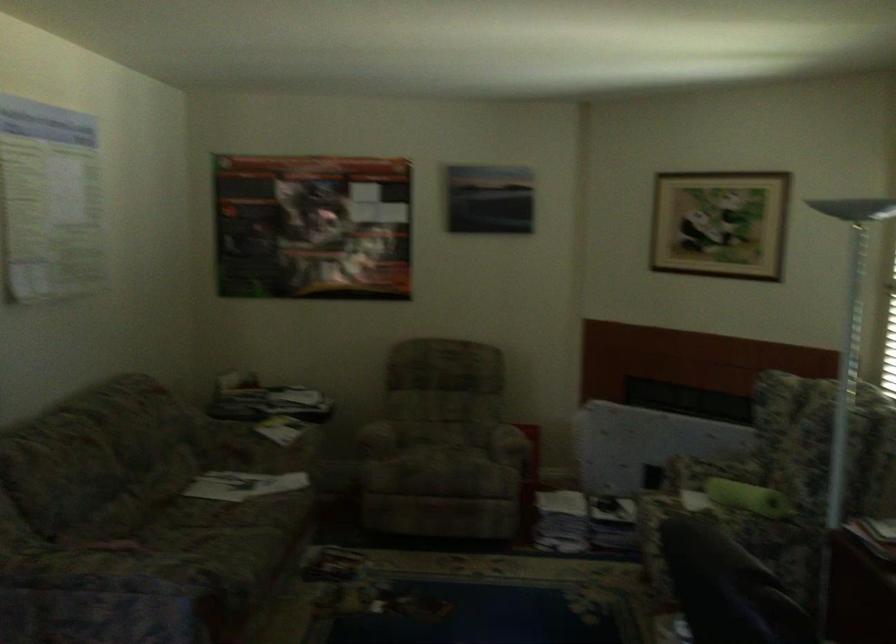
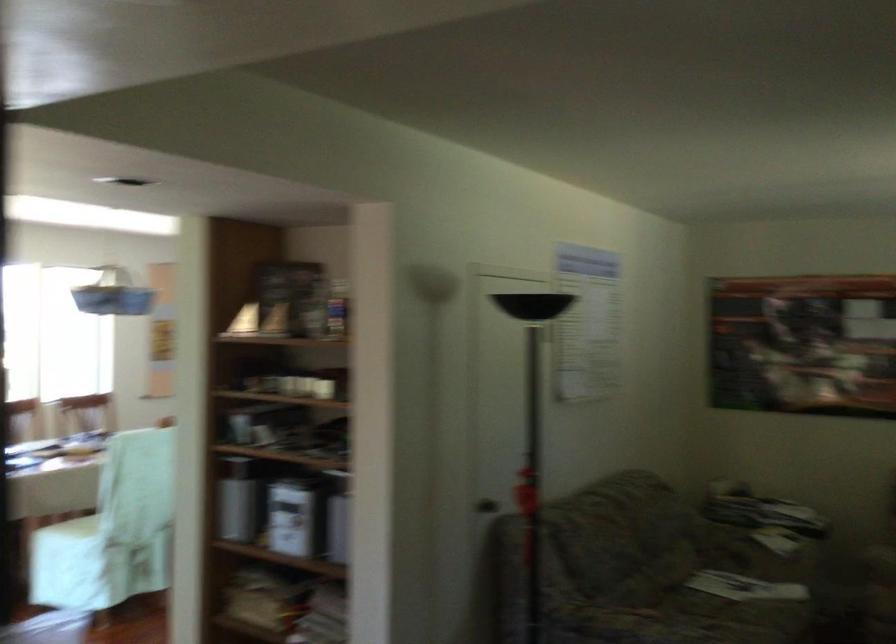
Question: The camera is either moving clockwise (left) or counter-clockwise (right) around the object. The first image is from the beginning of the video and the second image is from the end. Is the camera moving left or right when shooting the video?

Choices:
 (A) Left
 (B) Right

Answer: (B)